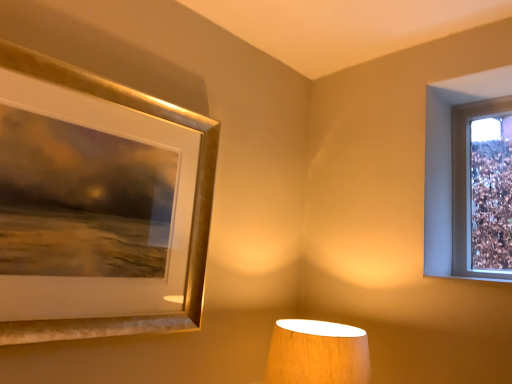
What do you see at coordinates (192, 215) in the screenshot? I see `gold metallic picture frame at upper left` at bounding box center [192, 215].

Identify the location of gold metallic picture frame at upper left. The image size is (512, 384). (192, 215).

Describe the element at coordinates (317, 353) in the screenshot. I see `wooden lampshade at lower center` at that location.

Identify the location of wooden lampshade at lower center. The image size is (512, 384). (317, 353).

The width and height of the screenshot is (512, 384). I want to click on gold metallic picture frame at upper left, so click(192, 215).

Considering the relative positions of wooden lampshade at lower center and gold metallic picture frame at upper left in the image provided, is wooden lampshade at lower center to the right of gold metallic picture frame at upper left from the viewer's perspective?

Yes.

Is wooden lampshade at lower center behind gold metallic picture frame at upper left?

Yes, the depth of wooden lampshade at lower center is greater than that of gold metallic picture frame at upper left.

Considering the positions of point (289, 375) and point (175, 320), is point (289, 375) closer or farther from the camera than point (175, 320)?

Point (289, 375) is positioned closer to the camera compared to point (175, 320).

From the image's perspective, which is above, wooden lampshade at lower center or gold metallic picture frame at upper left?

gold metallic picture frame at upper left appears higher in the image.

From a real-world perspective, is wooden lampshade at lower center under gold metallic picture frame at upper left?

Yes.

Does wooden lampshade at lower center have a greater width compared to gold metallic picture frame at upper left?

Yes, wooden lampshade at lower center is wider than gold metallic picture frame at upper left.

Who is taller, wooden lampshade at lower center or gold metallic picture frame at upper left?

gold metallic picture frame at upper left is taller.

Can you confirm if wooden lampshade at lower center is smaller than gold metallic picture frame at upper left?

Yes.

Is wooden lampshade at lower center surrounding gold metallic picture frame at upper left?

Definitely not — gold metallic picture frame at upper left is not inside wooden lampshade at lower center.

Is wooden lampshade at lower center positioned far away from gold metallic picture frame at upper left?

They are positioned close to each other.

Is wooden lampshade at lower center aimed at gold metallic picture frame at upper left?

No, wooden lampshade at lower center is not turned towards gold metallic picture frame at upper left.

What's the angular difference between wooden lampshade at lower center and gold metallic picture frame at upper left's facing directions?

The angle between the facing direction of wooden lampshade at lower center and the facing direction of gold metallic picture frame at upper left is 0.592 degrees.

Where is `lamp to the right of gold metallic picture frame at upper left`? This screenshot has width=512, height=384. lamp to the right of gold metallic picture frame at upper left is located at coordinates [317, 353].

Would you say gold metallic picture frame at upper left is to the left or to the right of wooden lampshade at lower center in the picture?

Clearly, gold metallic picture frame at upper left is on the left of wooden lampshade at lower center in the image.

Which object is more forward, gold metallic picture frame at upper left or wooden lampshade at lower center?

gold metallic picture frame at upper left is closer to the camera.

Is point (187, 269) positioned before point (298, 355)?

No, it is behind (298, 355).

From the image's perspective, does gold metallic picture frame at upper left appear lower than wooden lampshade at lower center?

No, from the image's perspective, gold metallic picture frame at upper left is not beneath wooden lampshade at lower center.

From a real-world perspective, is gold metallic picture frame at upper left beneath wooden lampshade at lower center?

No.

Which object is wider, gold metallic picture frame at upper left or wooden lampshade at lower center?

With larger width is wooden lampshade at lower center.

Can you confirm if gold metallic picture frame at upper left is shorter than wooden lampshade at lower center?

Incorrect, the height of gold metallic picture frame at upper left does not fall short of that of wooden lampshade at lower center.

Can you confirm if gold metallic picture frame at upper left is bigger than wooden lampshade at lower center?

Yes, gold metallic picture frame at upper left is bigger than wooden lampshade at lower center.

Is wooden lampshade at lower center completely or partially inside gold metallic picture frame at upper left?

No, wooden lampshade at lower center is located outside of gold metallic picture frame at upper left.

Is gold metallic picture frame at upper left placed right next to wooden lampshade at lower center?

gold metallic picture frame at upper left and wooden lampshade at lower center are clearly separated.

Looking at this image, is gold metallic picture frame at upper left looking in the opposite direction of wooden lampshade at lower center?

No, gold metallic picture frame at upper left is not facing away from wooden lampshade at lower center.

The image size is (512, 384). I want to click on lamp below the gold metallic picture frame at upper left (from a real-world perspective), so pos(317,353).

You are a GUI agent. You are given a task and a screenshot of the screen. Output one action in this format:
    pyautogui.click(x=<x>, y=<y>)
    Task: Click on the lamp behind the gold metallic picture frame at upper left
    This screenshot has height=384, width=512.
    Given the screenshot: What is the action you would take?
    pyautogui.click(x=317, y=353)

This screenshot has height=384, width=512. What are the coordinates of `picture frame in front of the wooden lampshade at lower center` in the screenshot? It's located at (192, 215).